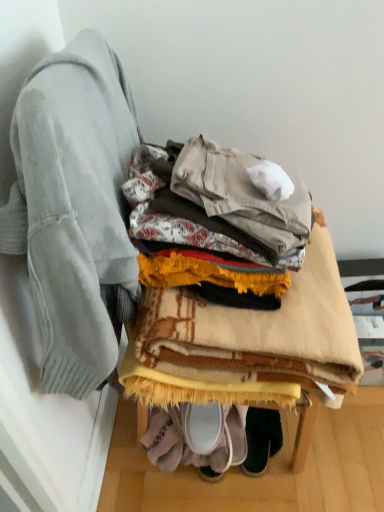
Question: Considering the relative sizes of light gray sweater at left and beige woven blanket at center in the image provided, is light gray sweater at left taller than beige woven blanket at center?

Choices:
 (A) yes
 (B) no

Answer: (A)

Question: Is beige woven blanket at center at the back of light gray sweater at left?

Choices:
 (A) yes
 (B) no

Answer: (B)

Question: From the image's perspective, is light gray sweater at left over beige woven blanket at center?

Choices:
 (A) no
 (B) yes

Answer: (B)

Question: Considering the relative sizes of light gray sweater at left and beige woven blanket at center in the image provided, is light gray sweater at left thinner than beige woven blanket at center?

Choices:
 (A) no
 (B) yes

Answer: (B)

Question: Is light gray sweater at left outside of beige woven blanket at center?

Choices:
 (A) yes
 (B) no

Answer: (A)

Question: Based on their positions, is light gray sweater at left located to the left or right of beige woven blanket at center?

Choices:
 (A) left
 (B) right

Answer: (A)

Question: Considering the positions of light gray sweater at left and beige woven blanket at center in the image, is light gray sweater at left bigger or smaller than beige woven blanket at center?

Choices:
 (A) big
 (B) small

Answer: (B)

Question: From a real-world perspective, is light gray sweater at left positioned above or below beige woven blanket at center?

Choices:
 (A) above
 (B) below

Answer: (A)

Question: Choose the correct answer: Is light gray sweater at left inside beige woven blanket at center or outside it?

Choices:
 (A) outside
 (B) inside

Answer: (A)

Question: Looking at the image, does dark green suede shoes at lower center seem bigger or smaller compared to beige woven blanket at center?

Choices:
 (A) big
 (B) small

Answer: (B)

Question: Is dark green suede shoes at lower center to the left or to the right of beige woven blanket at center in the image?

Choices:
 (A) right
 (B) left

Answer: (A)

Question: From their relative heights in the image, would you say dark green suede shoes at lower center is taller or shorter than beige woven blanket at center?

Choices:
 (A) tall
 (B) short

Answer: (B)

Question: Is point (258, 450) closer or farther from the camera than point (251, 322)?

Choices:
 (A) closer
 (B) farther

Answer: (B)

Question: Based on their positions, is beige woven blanket at center located to the left or right of light gray sweater at left?

Choices:
 (A) right
 (B) left

Answer: (A)

Question: Is beige woven blanket at center in front of or behind light gray sweater at left in the image?

Choices:
 (A) behind
 (B) front

Answer: (A)